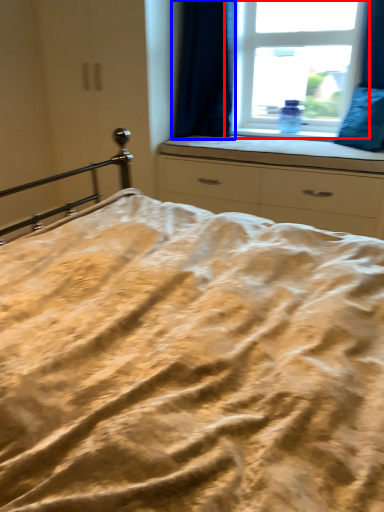
Question: Which of the following is the closest to the observer, window (highlighted by a red box) or curtain (highlighted by a blue box)?

Choices:
 (A) window
 (B) curtain

Answer: (B)